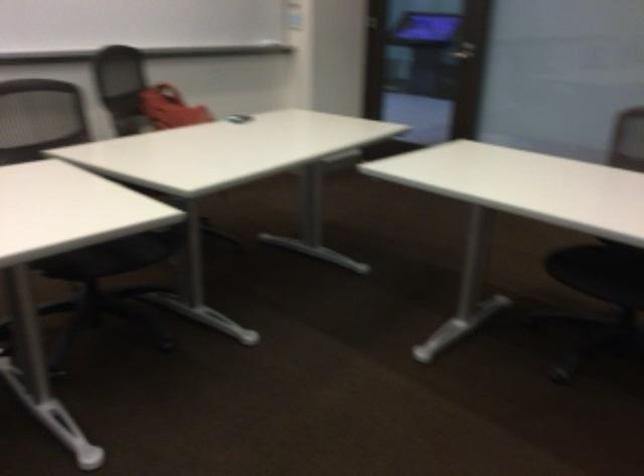
The image size is (644, 476). Describe the element at coordinates (459, 52) in the screenshot. I see `a door handle` at that location.